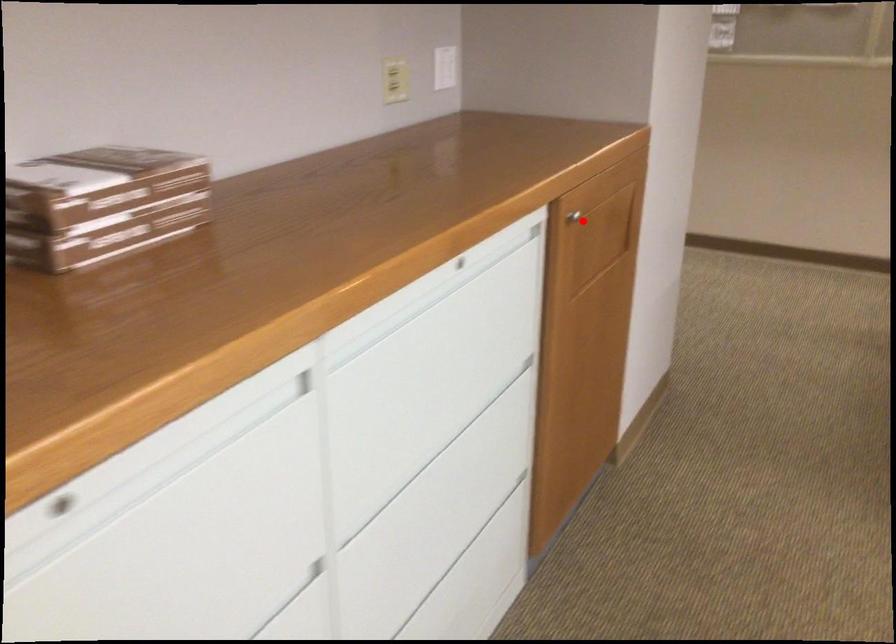
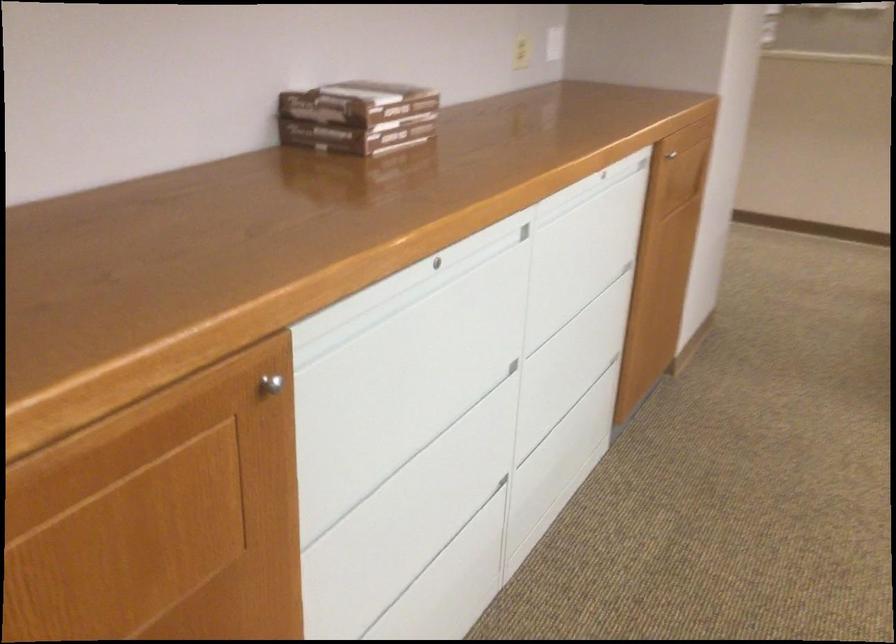
Where in the second image is the point corresponding to the highlighted location from the first image?

(675, 156)